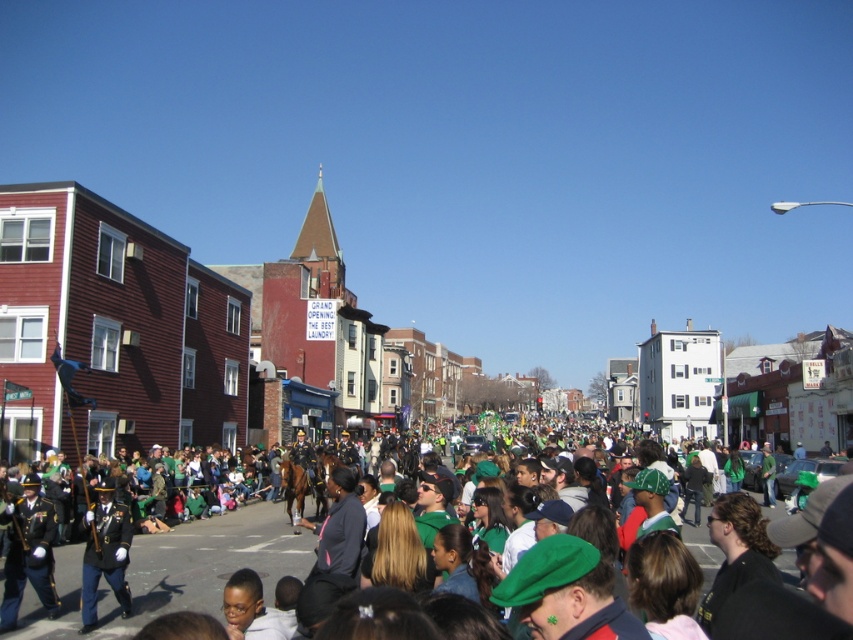
Measure the distance between shiny gold uniform at center and shiny black uniform at lower left.

They are 4.02 meters apart.

Between point (18, 589) and point (105, 481), which one is positioned behind?

The point (105, 481) is behind.

The height and width of the screenshot is (640, 853). Find the location of `shiny gold uniform at center`. shiny gold uniform at center is located at coordinates (28, 554).

From the picture: Between green fabric flag at center and shiny black uniform at lower left, which one is positioned higher?

shiny black uniform at lower left

Is point (256, 544) farther from viewer compared to point (129, 609)?

That is True.

This screenshot has height=640, width=853. Find the location of `green fabric flag at center`. green fabric flag at center is located at coordinates (204, 564).

Does green fabric flag at center have a lesser height compared to shiny gold uniform at center?

Yes.

Between green fabric flag at center and shiny gold uniform at center, which one is positioned lower?

green fabric flag at center is below.

Who is more distant from viewer, [192,593] or [21,525]?

The point [192,593] is more distant.

Find the location of `green fabric flag at center`. green fabric flag at center is located at coordinates (204, 564).